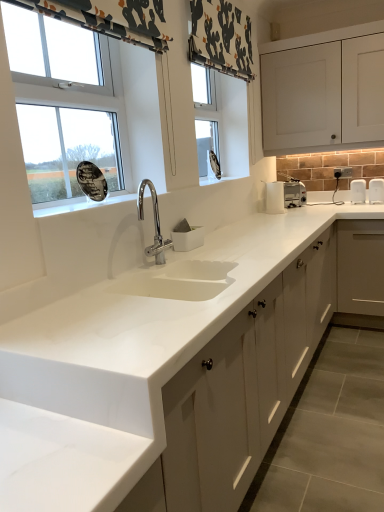
Question: Is white matte cabinet at center, which is the second cabinetry from top to bottom, not within patterned fabric curtain at upper left?

Choices:
 (A) yes
 (B) no

Answer: (A)

Question: From the image's perspective, is white matte cabinet at center, placed as the 1th cabinetry when sorted from bottom to top, located beneath patterned fabric curtain at upper left?

Choices:
 (A) no
 (B) yes

Answer: (B)

Question: Considering the relative positions of white matte cabinet at center, placed as the 1th cabinetry when sorted from bottom to top, and patterned fabric curtain at upper left in the image provided, is white matte cabinet at center, placed as the 1th cabinetry when sorted from bottom to top, to the left of patterned fabric curtain at upper left from the viewer's perspective?

Choices:
 (A) yes
 (B) no

Answer: (B)

Question: Is the position of white matte cabinet at center, which is the second cabinetry from top to bottom, less distant than that of patterned fabric curtain at upper left?

Choices:
 (A) yes
 (B) no

Answer: (B)

Question: Is white matte cabinet at center, which is the second cabinetry from top to bottom, smaller than patterned fabric curtain at upper left?

Choices:
 (A) no
 (B) yes

Answer: (A)

Question: Based on their positions, is patterned fabric curtain at upper left located to the left or right of white glossy window at upper left?

Choices:
 (A) left
 (B) right

Answer: (B)

Question: From the image's perspective, relative to white glossy window at upper left, is patterned fabric curtain at upper left above or below?

Choices:
 (A) below
 (B) above

Answer: (B)

Question: Considering the positions of point (144, 9) and point (16, 49), is point (144, 9) closer or farther from the camera than point (16, 49)?

Choices:
 (A) closer
 (B) farther

Answer: (B)

Question: In terms of width, does patterned fabric curtain at upper left look wider or thinner when compared to white glossy window at upper left?

Choices:
 (A) wide
 (B) thin

Answer: (B)

Question: Is white glossy window at upper left wider or thinner than white matte cabinet at center, placed as the 1th cabinetry when sorted from bottom to top?

Choices:
 (A) thin
 (B) wide

Answer: (A)

Question: Based on their positions, is white glossy window at upper left located to the left or right of white matte cabinet at center, which is the second cabinetry from top to bottom?

Choices:
 (A) left
 (B) right

Answer: (A)

Question: From the image's perspective, is white glossy window at upper left positioned above or below white matte cabinet at center, which is the second cabinetry from top to bottom?

Choices:
 (A) above
 (B) below

Answer: (A)

Question: From a real-world perspective, is white glossy window at upper left above or below white matte cabinet at center, placed as the 1th cabinetry when sorted from bottom to top?

Choices:
 (A) below
 (B) above

Answer: (B)

Question: From their relative heights in the image, would you say patterned fabric curtain at upper left is taller or shorter than white matte cabinet at upper right, the first cabinetry from the top?

Choices:
 (A) tall
 (B) short

Answer: (B)

Question: From the image's perspective, relative to white matte cabinet at upper right, which appears as the second cabinetry when ordered from the bottom, is patterned fabric curtain at upper left above or below?

Choices:
 (A) above
 (B) below

Answer: (B)